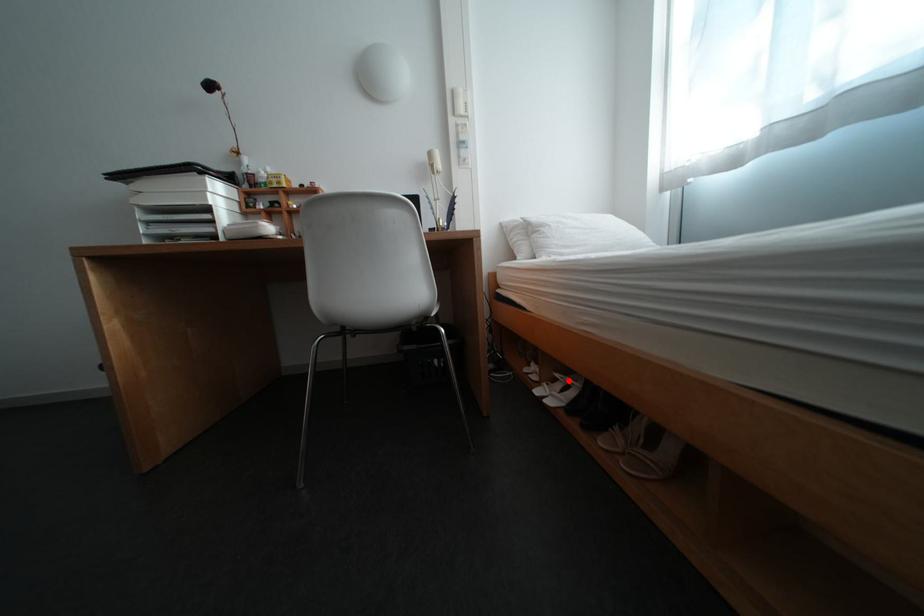
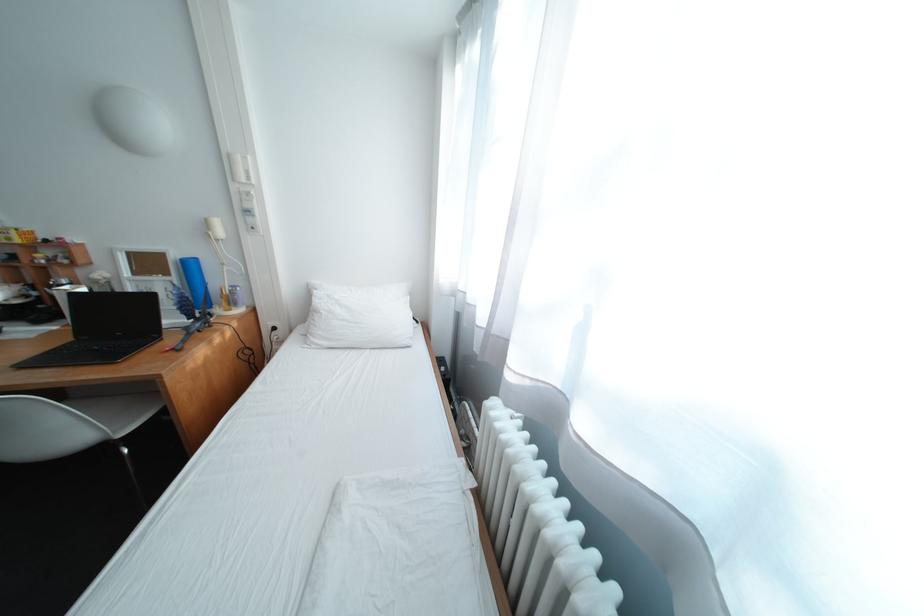
Question: I am providing you with two images of the same scene from different viewpoints. A red point is marked on the first image. Can you still see the location of the red point in image 2?

Choices:
 (A) Yes
 (B) No

Answer: (B)